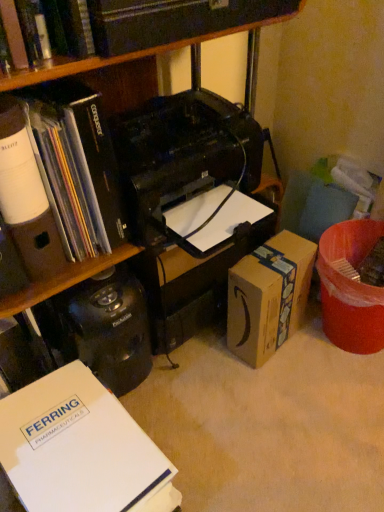
Question: Is hardcover book at upper center, which is counted as the 3th book, starting from the bottom, surrounding brown cardboard box at lower right?

Choices:
 (A) yes
 (B) no

Answer: (B)

Question: From the image's perspective, is hardcover book at upper center, the 1th book viewed from the top, below brown cardboard box at lower right?

Choices:
 (A) no
 (B) yes

Answer: (A)

Question: Can you confirm if hardcover book at upper center, the 1th book viewed from the top, is positioned to the right of brown cardboard box at lower right?

Choices:
 (A) no
 (B) yes

Answer: (A)

Question: Is hardcover book at upper center, which is counted as the 3th book, starting from the bottom, facing away from brown cardboard box at lower right?

Choices:
 (A) yes
 (B) no

Answer: (B)

Question: Is hardcover book at upper center, which is counted as the 3th book, starting from the bottom, located outside brown cardboard box at lower right?

Choices:
 (A) yes
 (B) no

Answer: (A)

Question: From the image's perspective, does hardcover book at upper center, the 1th book viewed from the top, appear higher than black matte bookcase at upper left?

Choices:
 (A) no
 (B) yes

Answer: (B)

Question: From a real-world perspective, is hardcover book at upper center, which is counted as the 3th book, starting from the bottom, on black matte bookcase at upper left?

Choices:
 (A) no
 (B) yes

Answer: (B)

Question: Is hardcover book at upper center, the 1th book viewed from the top, far from black matte bookcase at upper left?

Choices:
 (A) yes
 (B) no

Answer: (B)

Question: Is hardcover book at upper center, which is counted as the 3th book, starting from the bottom, looking in the opposite direction of black matte bookcase at upper left?

Choices:
 (A) yes
 (B) no

Answer: (B)

Question: Is hardcover book at upper center, the 1th book viewed from the top, thinner than black matte bookcase at upper left?

Choices:
 (A) no
 (B) yes

Answer: (B)

Question: Is the depth of hardcover book at upper center, which is counted as the 3th book, starting from the bottom, less than that of black matte bookcase at upper left?

Choices:
 (A) no
 (B) yes

Answer: (B)

Question: Considering the relative sizes of white paper at lower left, the 1th book positioned from the bottom, and brown cardboard box at lower right in the image provided, is white paper at lower left, the 1th book positioned from the bottom, taller than brown cardboard box at lower right?

Choices:
 (A) no
 (B) yes

Answer: (A)